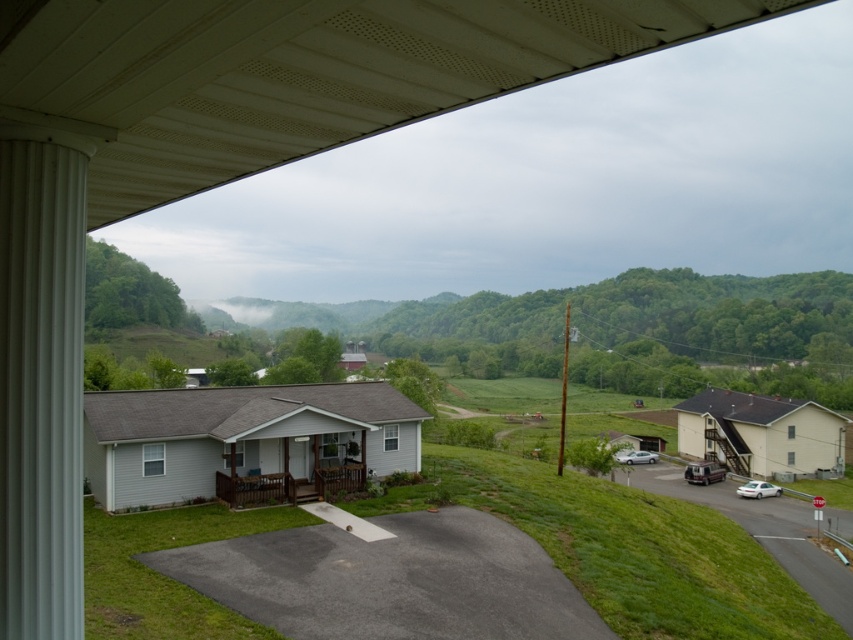
Question: Estimate the real-world distances between objects in this image. Which object is closer to the metallic silver van at lower right?

Choices:
 (A) brown wooden porch at lower center
 (B) silver metallic sedan at lower right

Answer: (B)

Question: Does white smooth column at left appear under brown wooden porch at lower center?

Choices:
 (A) no
 (B) yes

Answer: (A)

Question: Which point is farther to the camera?

Choices:
 (A) (277, 536)
 (B) (263, 474)
 (C) (714, 476)
 (D) (656, 454)

Answer: (D)

Question: Is white smooth column at left smaller than white glossy sedan at lower right?

Choices:
 (A) yes
 (B) no

Answer: (A)

Question: Does black asphalt driveway at lower center appear under silver metallic sedan at lower right?

Choices:
 (A) yes
 (B) no

Answer: (B)

Question: Based on their relative distances, which object is nearer to the black asphalt driveway at lower center?

Choices:
 (A) silver metallic sedan at lower right
 (B) white smooth column at left
 (C) white glossy sedan at lower right

Answer: (B)